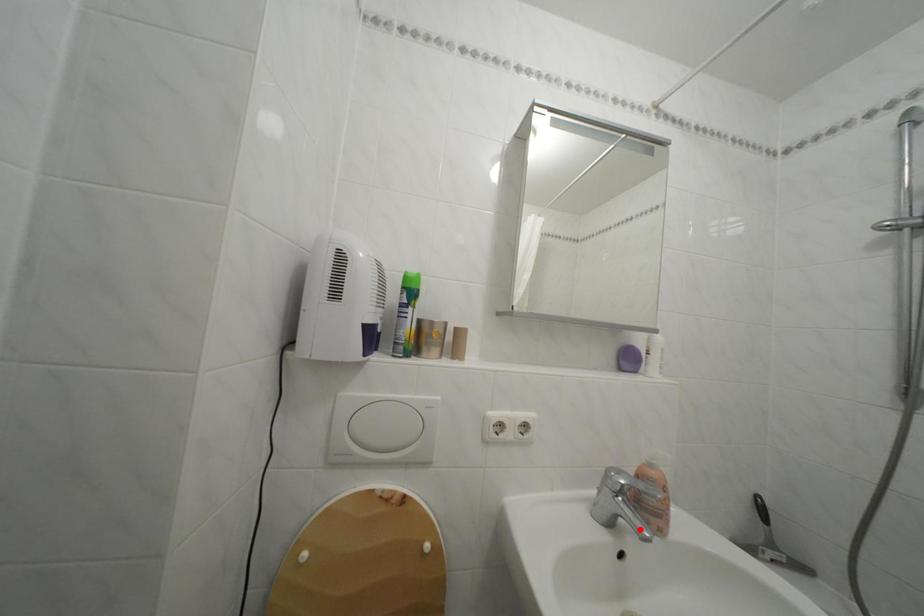
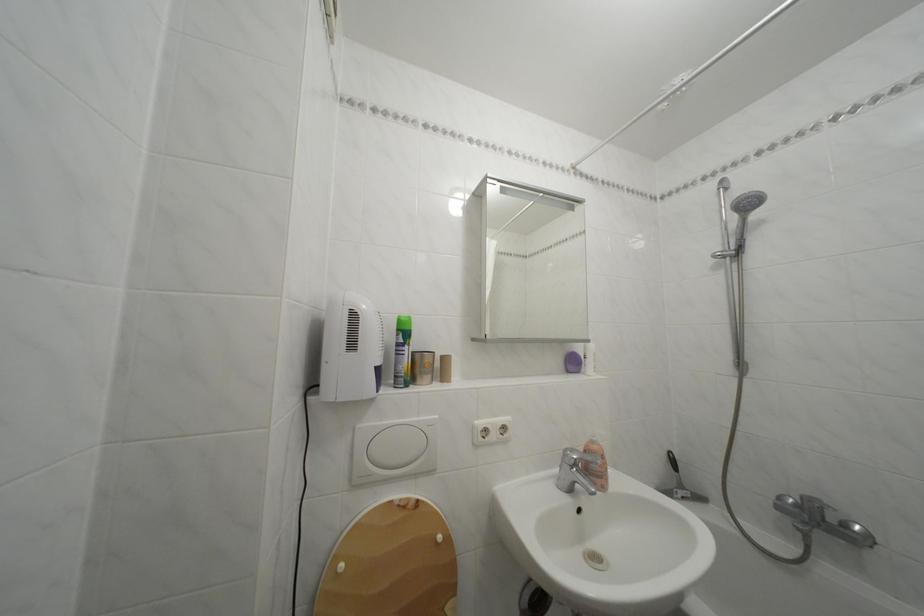
In the second image, find the point that corresponds to the highlighted location in the first image.

(592, 492)